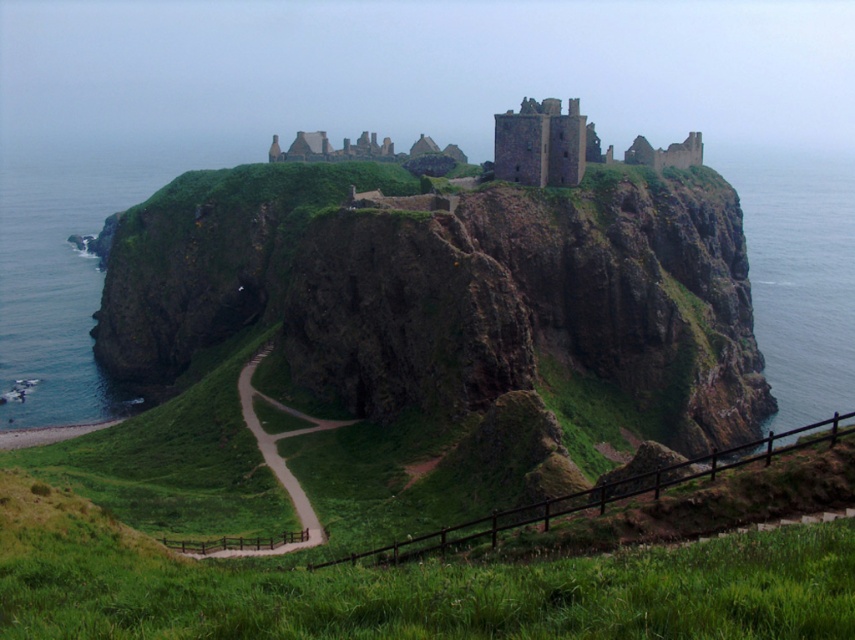
Between clear blue water at cliff edge and dirt/gravel path at center, which one is positioned lower?

dirt/gravel path at center is lower down.

Who is higher up, clear blue water at cliff edge or dirt/gravel path at center?

Positioned higher is clear blue water at cliff edge.

Image resolution: width=855 pixels, height=640 pixels. I want to click on clear blue water at cliff edge, so click(x=799, y=273).

Is greenish-blue water at lower left to the right of dirt/gravel path at center from the viewer's perspective?

No, greenish-blue water at lower left is not to the right of dirt/gravel path at center.

Does point (15, 422) lie behind point (319, 541)?

Yes, it is.

You are a GUI agent. You are given a task and a screenshot of the screen. Output one action in this format:
    pyautogui.click(x=<x>, y=<y>)
    Task: Click on the greenish-blue water at lower left
    This screenshot has width=855, height=640.
    Given the screenshot: What is the action you would take?
    pyautogui.click(x=69, y=264)

Can you confirm if greenish-blue water at lower left is positioned to the left of clear blue water at cliff edge?

Correct, you'll find greenish-blue water at lower left to the left of clear blue water at cliff edge.

Is greenish-blue water at lower left closer to the viewer compared to clear blue water at cliff edge?

Yes, it is in front of clear blue water at cliff edge.

Measure the distance between point (69, 212) and camera.

They are 365.67 meters apart.

Locate an element on the screen. This screenshot has height=640, width=855. greenish-blue water at lower left is located at coordinates (69, 264).